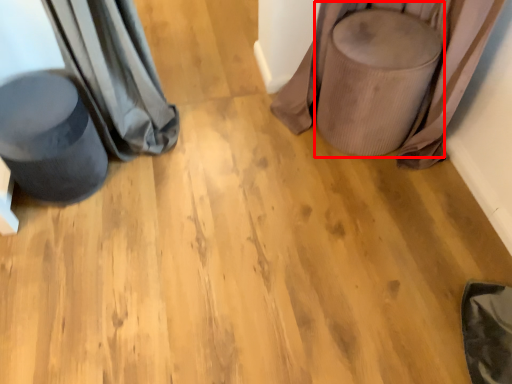
Question: From the image's perspective, considering the relative positions of swivel chair (annotated by the red box) and swivel chair in the image provided, where is swivel chair (annotated by the red box) located with respect to the staircase?

Choices:
 (A) above
 (B) below

Answer: (A)